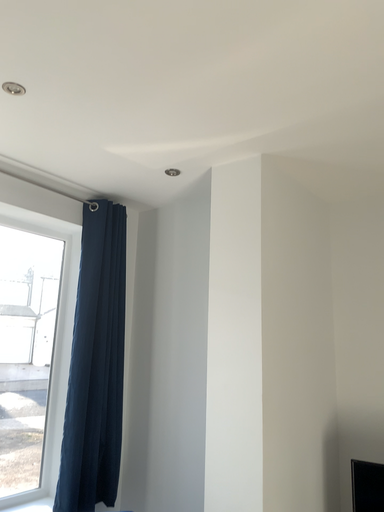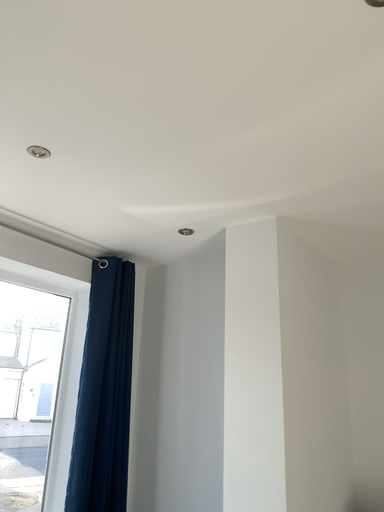
Question: Which way did the camera rotate in the video?

Choices:
 (A) rotated upward
 (B) rotated downward

Answer: (A)